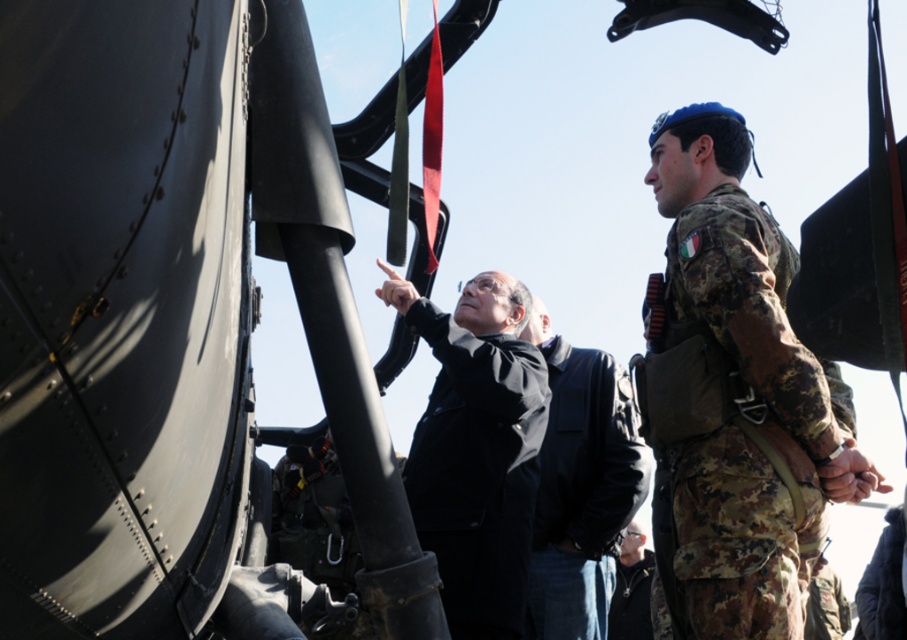
Is point (756, 429) closer to camera compared to point (525, 500)?

Yes, it is in front of point (525, 500).

Is the position of camo fabric uniform at right more distant than that of camouflage fabric uniform at center?

That is False.

Which is behind, point (685, 609) or point (509, 490)?

The point (509, 490) is more distant.

This screenshot has height=640, width=907. In order to click on camo fabric uniform at right in this screenshot , I will do `click(739, 428)`.

Measure the distance from camo fabric uniform at right to shiny black sunglasses at center.

A distance of 18.87 feet exists between camo fabric uniform at right and shiny black sunglasses at center.

This screenshot has width=907, height=640. Describe the element at coordinates (739, 428) in the screenshot. I see `camo fabric uniform at right` at that location.

Which is in front, point (801, 572) or point (632, 547)?

Point (801, 572) is in front.

Where is `camo fabric uniform at right`? The image size is (907, 640). camo fabric uniform at right is located at coordinates (739, 428).

Based on the photo, is the position of camouflage fabric uniform at center less distant than that of shiny black sunglasses at center?

Yes, it is.

At what (x,y) coordinates should I click in order to perform the action: click on camouflage fabric uniform at center. Please return your answer as a coordinate pair (x, y). The image size is (907, 640). Looking at the image, I should click on (476, 470).